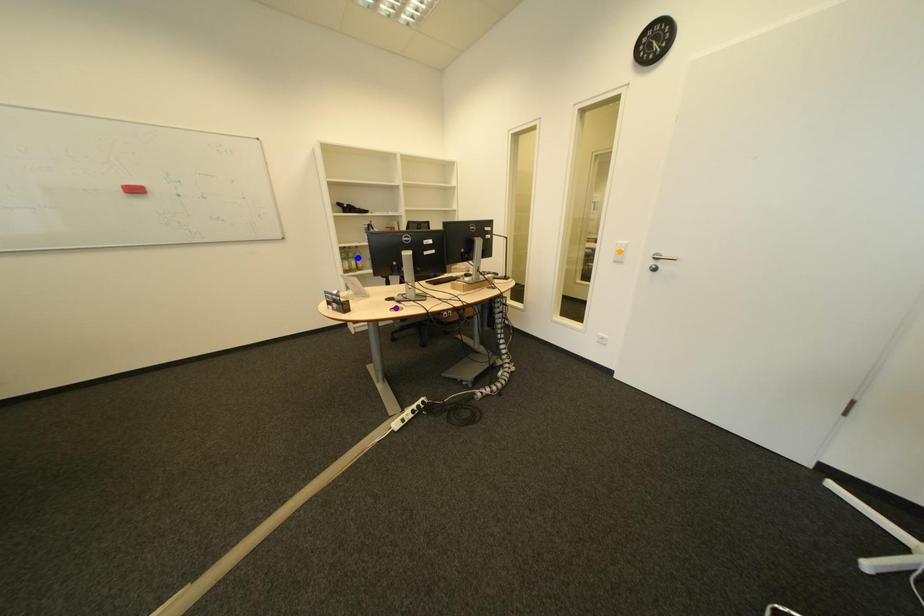
Order these from nearest to farthest:
purple point
orange point
blue point

1. purple point
2. blue point
3. orange point